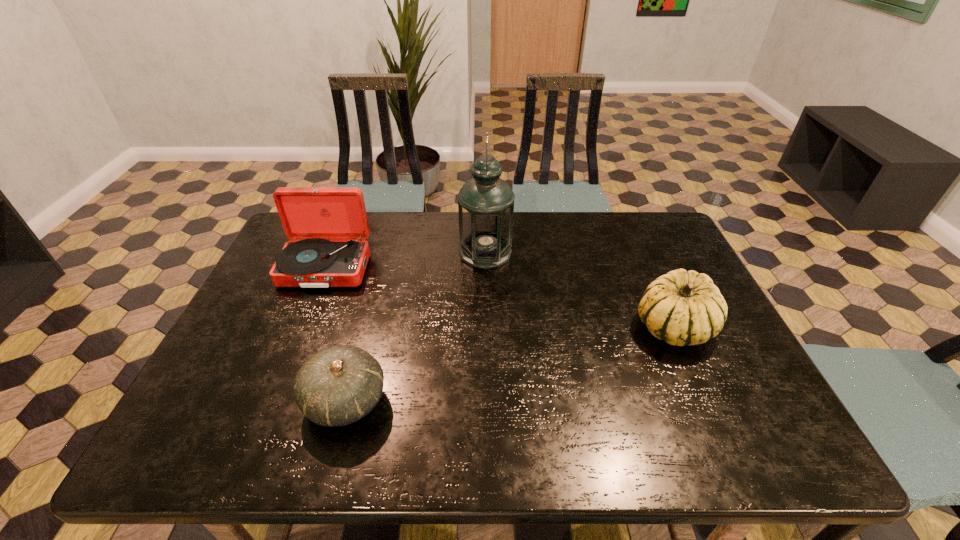
The height and width of the screenshot is (540, 960). Find the location of `the tallest object`. the tallest object is located at coordinates (485, 203).

In order to click on oil lamp in this screenshot , I will do `click(485, 203)`.

Image resolution: width=960 pixels, height=540 pixels. What are the coordinates of `the second tallest object` in the screenshot? It's located at (327, 226).

At what (x,y) coordinates should I click in order to perform the action: click on the second nearest object. Please return your answer as a coordinate pair (x, y). Image resolution: width=960 pixels, height=540 pixels. Looking at the image, I should click on (682, 307).

I want to click on the rightmost object, so click(x=682, y=307).

Find the location of a particular element. The image size is (960, 540). the shortest object is located at coordinates (338, 385).

I want to click on the nearest object, so click(x=338, y=385).

I want to click on vacant space located 0.230m on the front of the third object from left to right, so (x=487, y=327).

Find the location of a particular element. The image size is (960, 540). vacant space located on the front-facing side of the third shortest object is located at coordinates (282, 373).

The width and height of the screenshot is (960, 540). In order to click on free space located 0.090m on the front of the rightmost object in this screenshot , I will do `click(702, 388)`.